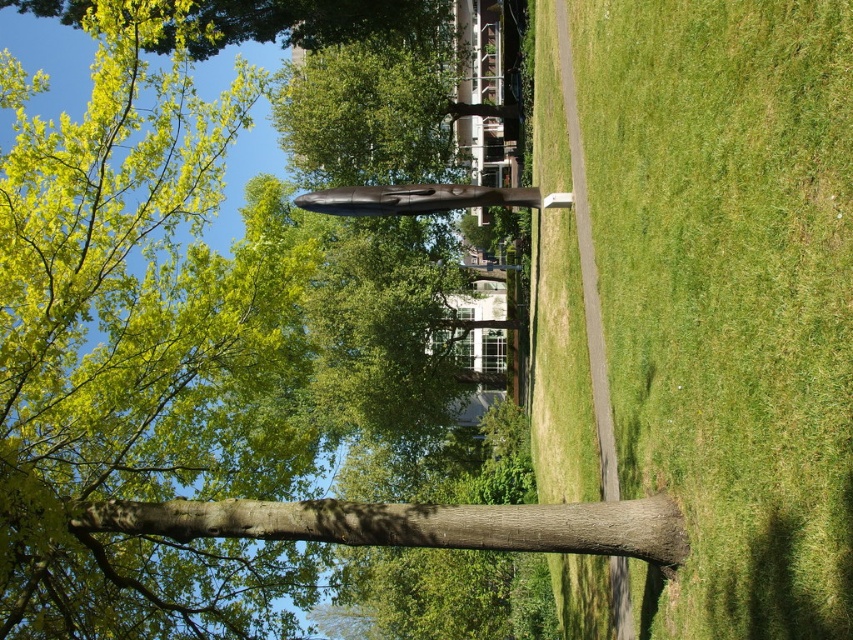
Question: Can you confirm if green grass at center is positioned to the left of brown rough tree trunk at center?

Choices:
 (A) yes
 (B) no

Answer: (B)

Question: Does green grass at center have a larger size compared to brown rough tree trunk at center?

Choices:
 (A) no
 (B) yes

Answer: (B)

Question: Is green grass at center positioned in front of brown rough tree trunk at center?

Choices:
 (A) no
 (B) yes

Answer: (B)

Question: Which point is farther to the camera?

Choices:
 (A) (633, 20)
 (B) (399, 520)

Answer: (A)

Question: Which point is closer to the camera?

Choices:
 (A) green grass at center
 (B) brown rough tree trunk at center

Answer: (A)